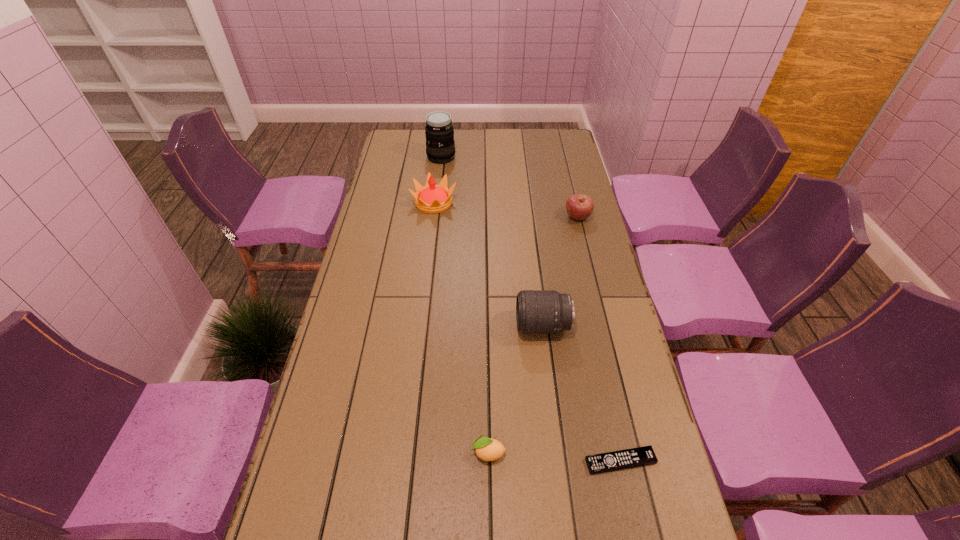
Image resolution: width=960 pixels, height=540 pixels. In order to click on free location located on the right of the crown in this screenshot , I will do `click(550, 203)`.

This screenshot has height=540, width=960. In order to click on free space located 0.220m on the surface of the nearer telephoto lens in this screenshot , I will do `click(443, 326)`.

Where is `vacant region located on the surface of the nearer telephoto lens`? vacant region located on the surface of the nearer telephoto lens is located at coordinates (426, 326).

At what (x,y) coordinates should I click in order to perform the action: click on blank area located on the surface of the nearer telephoto lens. Please return your answer as a coordinate pair (x, y). Looking at the image, I should click on (402, 326).

Where is `vacant region located 0.240m on the side of the third shortest object with the unique marking`? This screenshot has height=540, width=960. vacant region located 0.240m on the side of the third shortest object with the unique marking is located at coordinates (501, 217).

The width and height of the screenshot is (960, 540). I want to click on blank space located on the side of the third shortest object with the unique marking, so 551,217.

The image size is (960, 540). In order to click on vacant area situated 0.330m on the side of the third shortest object with the unique marking in this screenshot , I will do `click(478, 217)`.

Find the location of a particular element. vacant space located with leaves positioned above the lemon is located at coordinates (348, 453).

The height and width of the screenshot is (540, 960). In order to click on vacant region located with leaves positioned above the lemon in this screenshot , I will do `click(315, 453)`.

The height and width of the screenshot is (540, 960). What are the coordinates of `vacant space located with leaves positioned above the lemon` in the screenshot? It's located at (302, 453).